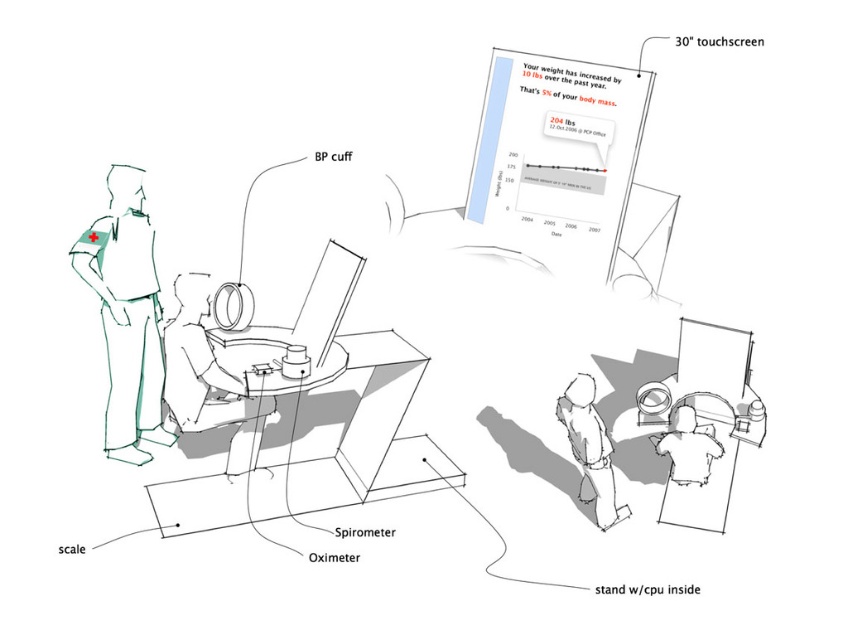
Between matte black monitor at center and light gray pants at lower center, which one is positioned lower?

light gray pants at lower center

Does point (170, 387) come closer to viewer compared to point (587, 442)?

No.

Who is more forward, (268, 412) or (590, 426)?

Point (590, 426)

This screenshot has height=640, width=848. Find the location of `matte black monitor at center`. matte black monitor at center is located at coordinates (208, 378).

Who is positioned more to the left, green fabric shirt at left or matte black monitor at center?

green fabric shirt at left

Between green fabric shirt at left and matte black monitor at center, which one has more height?

green fabric shirt at left

Locate an element on the screen. green fabric shirt at left is located at coordinates (126, 316).

How much distance is there between matte black monitor at center and white glossy shirt at center?

matte black monitor at center is 5.96 feet from white glossy shirt at center.

Find the location of a particular element. The height and width of the screenshot is (640, 848). matte black monitor at center is located at coordinates (208, 378).